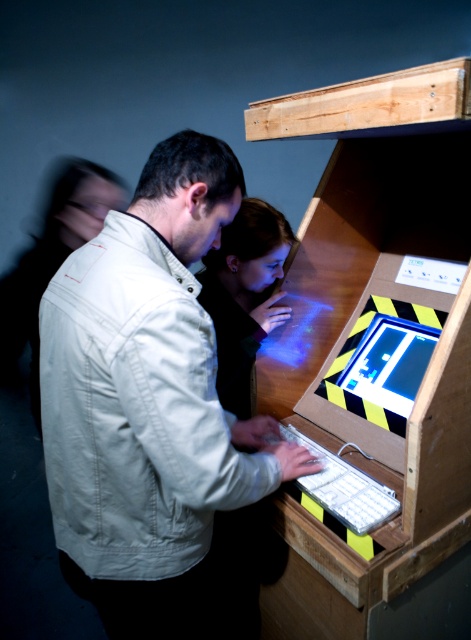
Which is more to the left, light beige jacket at center or white plastic keyboard at lower center?

light beige jacket at center

In the scene shown: Is light beige jacket at center above white plastic keyboard at lower center?

Correct, light beige jacket at center is located above white plastic keyboard at lower center.

Find the location of a particular element. Image resolution: width=471 pixels, height=640 pixels. light beige jacket at center is located at coordinates (243, 294).

Is white matte jacket at center to the right of white plastic keyboard at lower center from the viewer's perspective?

In fact, white matte jacket at center is to the left of white plastic keyboard at lower center.

The height and width of the screenshot is (640, 471). Describe the element at coordinates (148, 400) in the screenshot. I see `white matte jacket at center` at that location.

Is point (194, 618) behind point (300, 486)?

No.

Locate an element on the screen. white matte jacket at center is located at coordinates (148, 400).

Who is positioned more to the right, white matte jacket at center or light beige jacket at center?

Positioned to the right is light beige jacket at center.

Based on the photo, between white matte jacket at center and light beige jacket at center, which one is positioned higher?

light beige jacket at center

Is point (203, 387) farther from viewer compared to point (242, 209)?

No.

This screenshot has height=640, width=471. I want to click on white matte jacket at center, so click(148, 400).